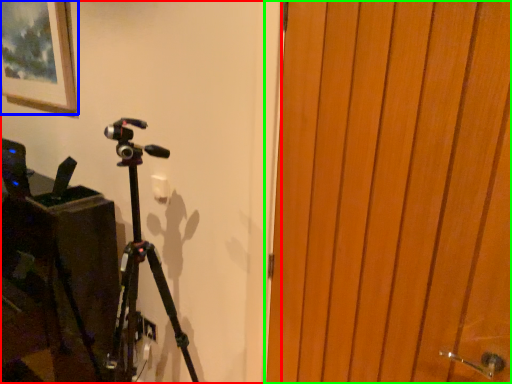
Question: Which is farther away from backdrop (highlighted by a red box)? picture frame (highlighted by a blue box) or door (highlighted by a green box)?

Choices:
 (A) picture frame
 (B) door

Answer: (A)